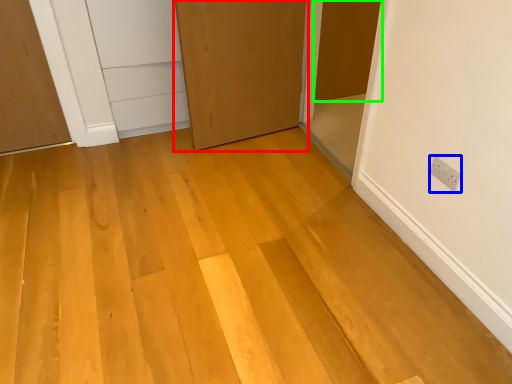
Question: Which is farther away from door (highlighted by a red box)? electric outlet (highlighted by a blue box) or door (highlighted by a green box)?

Choices:
 (A) electric outlet
 (B) door

Answer: (A)